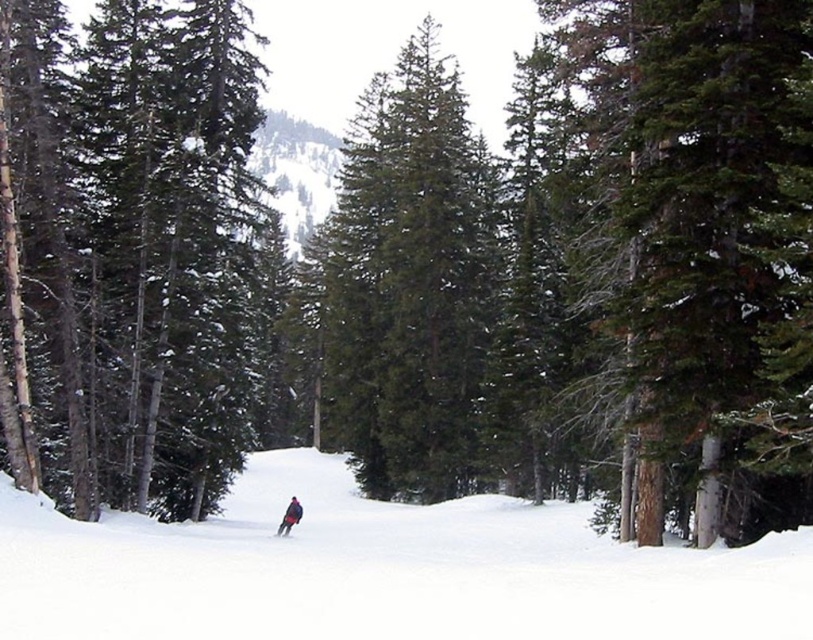
Question: Is the position of dark blue snowboarder at center more distant than that of shiny black ski at center?

Choices:
 (A) yes
 (B) no

Answer: (B)

Question: Can you confirm if green matte tree at center is wider than green evergreen tree at center?

Choices:
 (A) no
 (B) yes

Answer: (B)

Question: Which point is farther from the camera taking this photo?

Choices:
 (A) (287, 518)
 (B) (289, 525)

Answer: (B)

Question: Which object is the farthest from the green matte tree at center?

Choices:
 (A) green evergreen tree at center
 (B) white snow ski slope at center
 (C) dark blue snowboarder at center
 (D) shiny black ski at center

Answer: (A)

Question: Is white snow ski slope at center smaller than dark blue snowboarder at center?

Choices:
 (A) no
 (B) yes

Answer: (A)

Question: Among these objects, which one is nearest to the camera?

Choices:
 (A) dark blue snowboarder at center
 (B) green matte tree at center

Answer: (B)